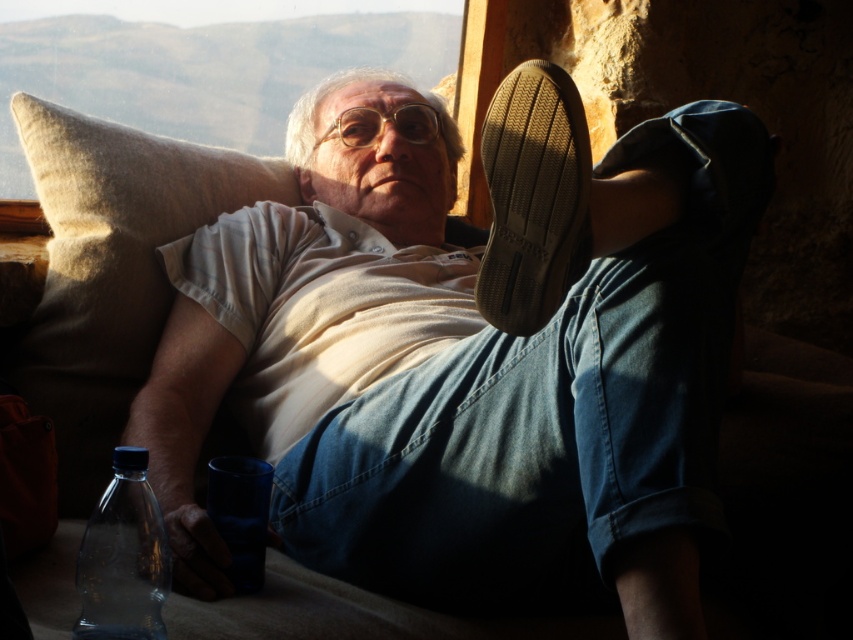
Can you confirm if matte brown shoe at upper center is thinner than brown leather shoe at upper right?

No, matte brown shoe at upper center is not thinner than brown leather shoe at upper right.

Between matte brown shoe at upper center and brown leather shoe at upper right, which one has less height?

With less height is brown leather shoe at upper right.

This screenshot has height=640, width=853. What are the coordinates of `matte brown shoe at upper center` in the screenshot? It's located at (467, 355).

This screenshot has width=853, height=640. Identify the location of transparent glass window at upper center. point(202,72).

Who is more distant from viewer, (508, 580) or (100, 564)?

Positioned behind is point (508, 580).

The width and height of the screenshot is (853, 640). What do you see at coordinates (467, 355) in the screenshot?
I see `matte brown shoe at upper center` at bounding box center [467, 355].

Between point (753, 204) and point (83, 602), which one is positioned in front?

Point (83, 602)

At what (x,y) coordinates should I click in order to perform the action: click on matte brown shoe at upper center. Please return your answer as a coordinate pair (x, y). Looking at the image, I should click on (467, 355).